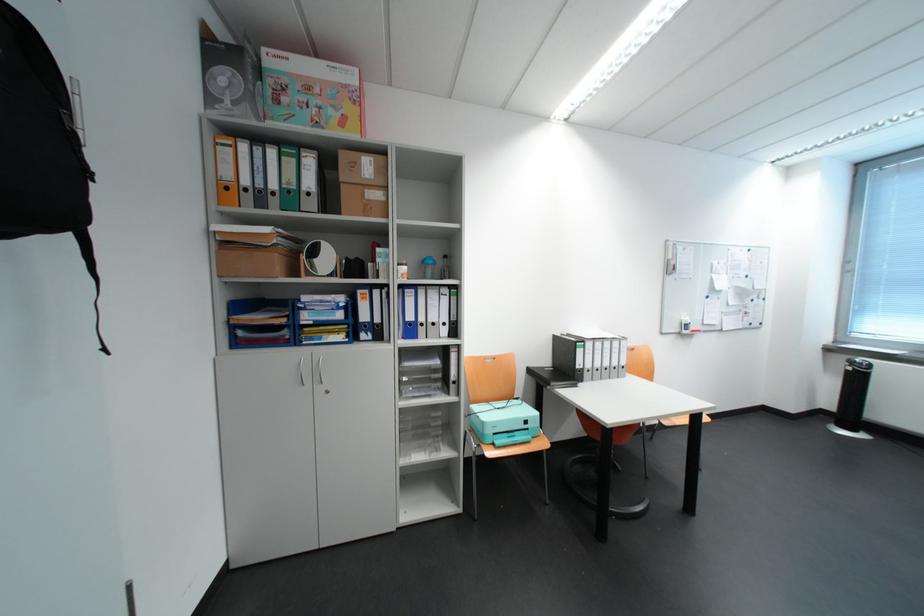
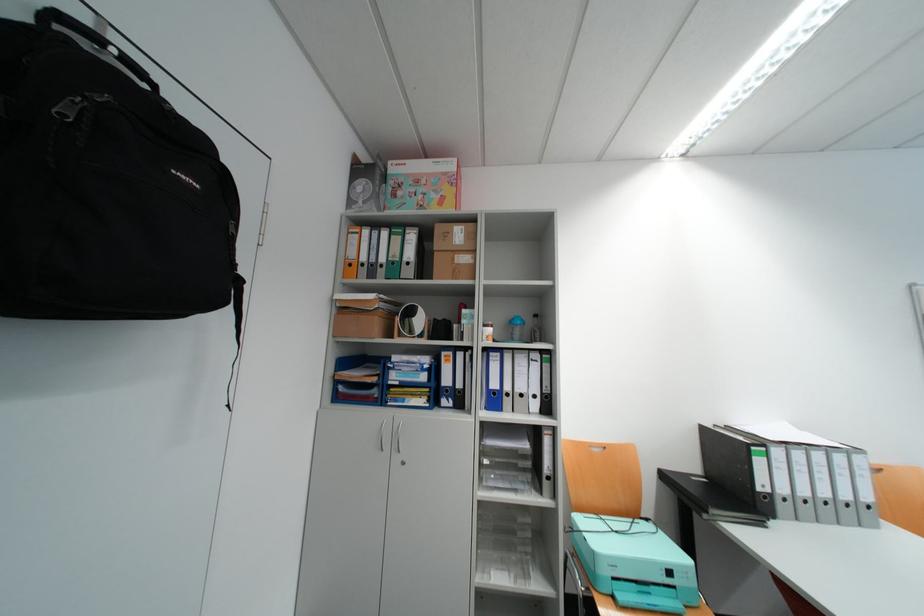
In the second image, find the point that corresponds to pixel 496 360 in the first image.

(602, 447)